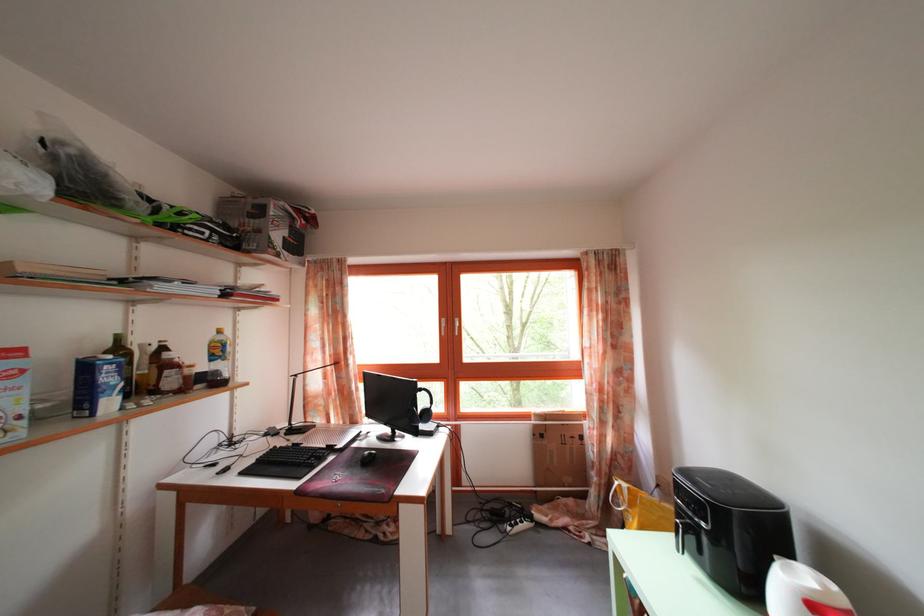
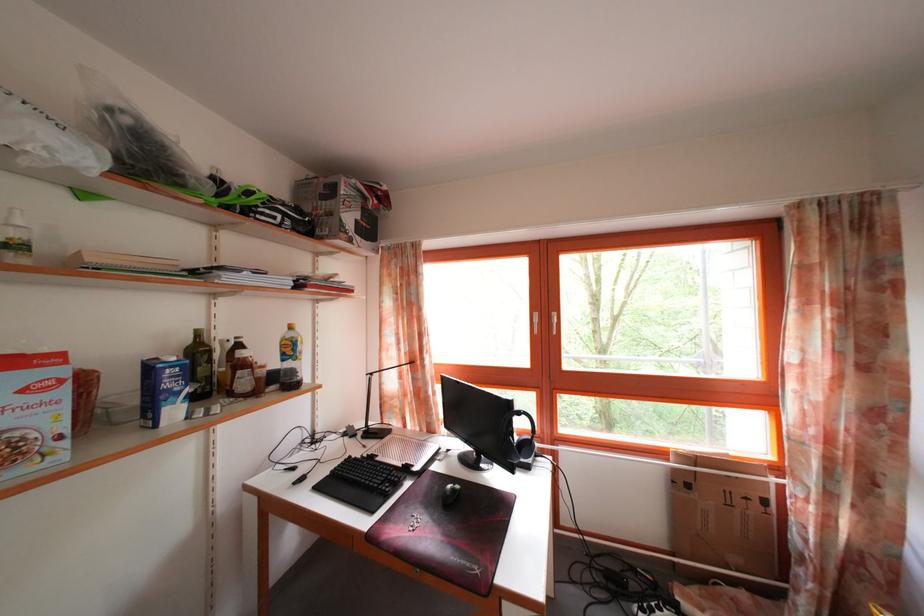
Question: How did the camera likely rotate?

Choices:
 (A) Left
 (B) Right
 (C) Up
 (D) Down

Answer: (A)